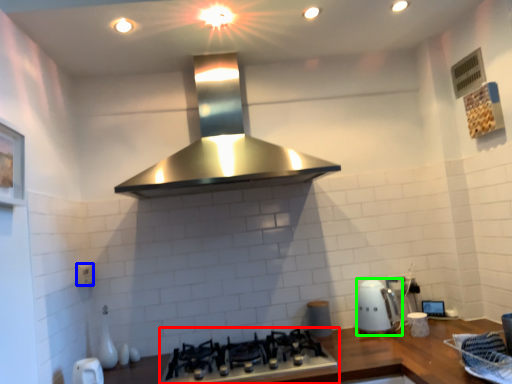
Question: Estimate the real-world distances between objects in this image. Which object is farther from gas stove (highlighted by a red box), electric outlet (highlighted by a blue box) or kitchen appliance (highlighted by a green box)?

Choices:
 (A) electric outlet
 (B) kitchen appliance

Answer: (A)